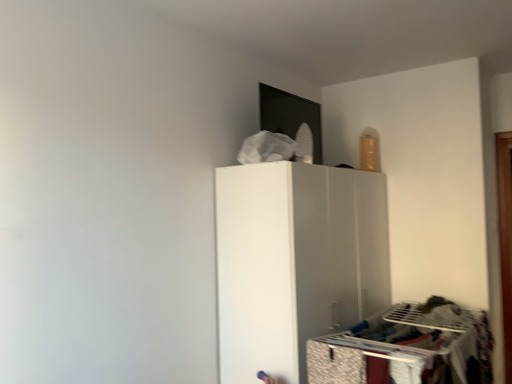
Question: From a real-world perspective, does patterned fabric drawer at lower right sit lower than white matte cabinet at center?

Choices:
 (A) yes
 (B) no

Answer: (A)

Question: Does patterned fabric drawer at lower right come behind white matte cabinet at center?

Choices:
 (A) no
 (B) yes

Answer: (A)

Question: Is patterned fabric drawer at lower right at the right side of white matte cabinet at center?

Choices:
 (A) yes
 (B) no

Answer: (B)

Question: Is patterned fabric drawer at lower right shorter than white matte cabinet at center?

Choices:
 (A) yes
 (B) no

Answer: (A)

Question: Is patterned fabric drawer at lower right aimed at white matte cabinet at center?

Choices:
 (A) no
 (B) yes

Answer: (A)

Question: Is white matte cabinet at center inside patterned fabric drawer at lower right?

Choices:
 (A) yes
 (B) no

Answer: (B)

Question: Does white matte cabinet at center have a lesser height compared to patterned fabric drawer at lower right?

Choices:
 (A) yes
 (B) no

Answer: (B)

Question: Does white matte cabinet at center have a greater height compared to patterned fabric drawer at lower right?

Choices:
 (A) no
 (B) yes

Answer: (B)

Question: Is white matte cabinet at center not within patterned fabric drawer at lower right?

Choices:
 (A) yes
 (B) no

Answer: (A)

Question: Can you confirm if white matte cabinet at center is thinner than patterned fabric drawer at lower right?

Choices:
 (A) no
 (B) yes

Answer: (A)

Question: Is white matte cabinet at center at the right side of patterned fabric drawer at lower right?

Choices:
 (A) no
 (B) yes

Answer: (B)

Question: From the image's perspective, does white matte cabinet at center appear lower than patterned fabric drawer at lower right?

Choices:
 (A) no
 (B) yes

Answer: (A)

Question: Which is correct: patterned fabric drawer at lower right is inside white matte cabinet at center, or outside of it?

Choices:
 (A) inside
 (B) outside

Answer: (B)